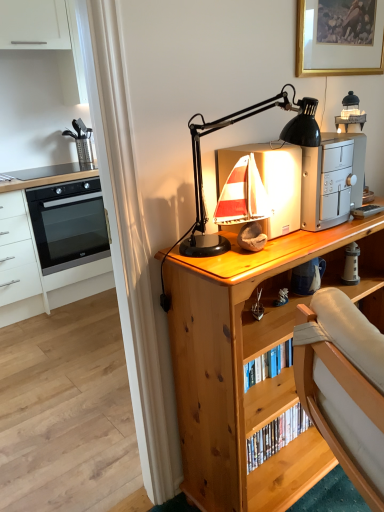
Question: From a real-world perspective, is wooden sailboat at upper center, the third appliance when ordered from right to left, physically located above or below black plastic lamp at upper center?

Choices:
 (A) below
 (B) above

Answer: (A)

Question: Is wooden sailboat at upper center, the first appliance when ordered from left to right, bigger or smaller than black plastic lamp at upper center?

Choices:
 (A) small
 (B) big

Answer: (A)

Question: Which of these objects is positioned farthest from the white ceramic lighthouse at right, placed as the 3th appliance when sorted from left to right?

Choices:
 (A) white glossy oven at left
 (B) gold-framed picture at upper right
 (C) black glass oven at left
 (D) black plastic lamp at upper center
 (E) wooden desk at center

Answer: (A)

Question: Estimate the real-world distances between objects in this image. Which object is closer to the black glass oven at left?

Choices:
 (A) silver metallic toaster at upper right, marked as the second appliance in a right-to-left arrangement
 (B) wooden sailboat at upper center, the third appliance when ordered from right to left
 (C) gold-framed picture at upper right
 (D) black plastic lamp at upper center
 (E) white matte cabinet at upper left

Answer: (E)